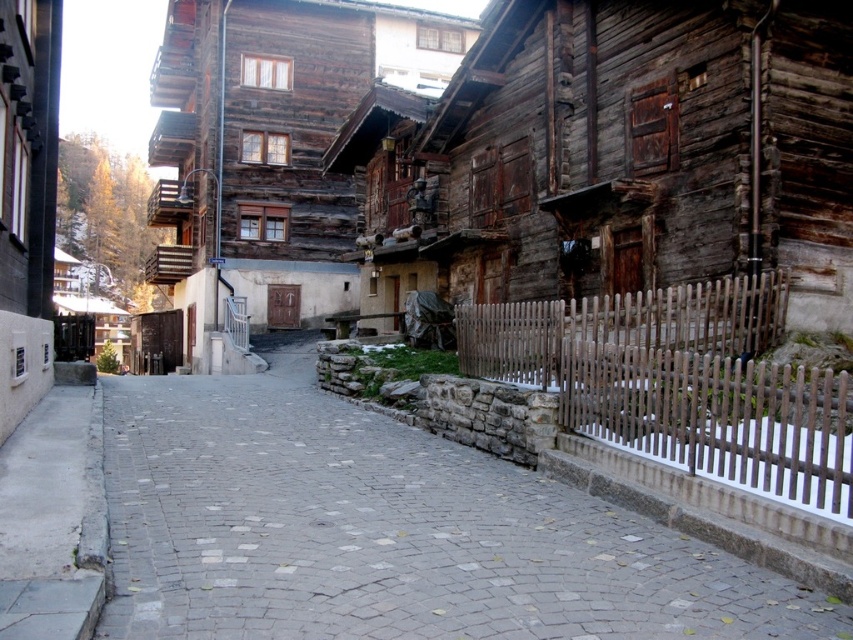
You are a delivery person with a cart that is 1.8 meters wide. You need to move from the gray concrete sidewalk at lower left to the brown wooden fence at lower right. Is there enough space between them for your cart to pass through?

The brown wooden fence at lower right is 16.56 meters away from the gray concrete sidewalk at lower left. Since your cart is only 1.8 meters wide, there is ample space for it to pass through the 16.56 meters distance between them.

You are standing at point (270, 410) in the alpine village street. You want to walk to the other side of the street. The street is 31.72 meters wide. Can you safely cross the street without any obstacles?

The street is 31.72 meters wide, so it would be difficult to cross safely as the width is quite large, but there are no obstacles mentioned in the scene description.

You are a delivery person with a cart that is 1.2 meters wide. You need to navigate through the quaint alpine village street scene. Which path, the gray cobblestone path at center or the gray concrete sidewalk at lower left, can your cart pass through without any issues?

The gray cobblestone path at center has a larger width than the gray concrete sidewalk at lower left, so the cart can pass through the gray cobblestone path at center without any issues since it is wider than the cart.